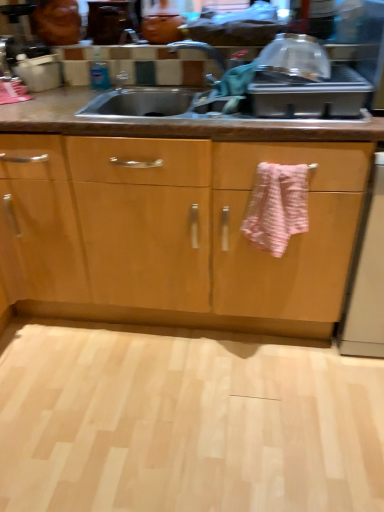
Question: In the image, is pink textured towel at center positioned in front of or behind white glossy dishwasher at right?

Choices:
 (A) front
 (B) behind

Answer: (B)

Question: Is point 248,205 positioned closer to the camera than point 362,303?

Choices:
 (A) closer
 (B) farther

Answer: (A)

Question: Considering the real-world distances, which object is farthest from the pink textured towel at center?

Choices:
 (A) white glossy dishwasher at right
 (B) light wood floor at lower center

Answer: (B)

Question: Which object is the closest to the white glossy dishwasher at right?

Choices:
 (A) pink textured towel at center
 (B) light wood floor at lower center

Answer: (A)